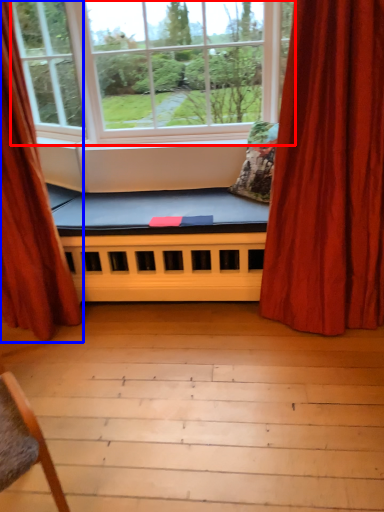
Question: Which point is closer to the camera, window (highlighted by a red box) or curtain (highlighted by a blue box)?

Choices:
 (A) window
 (B) curtain

Answer: (B)